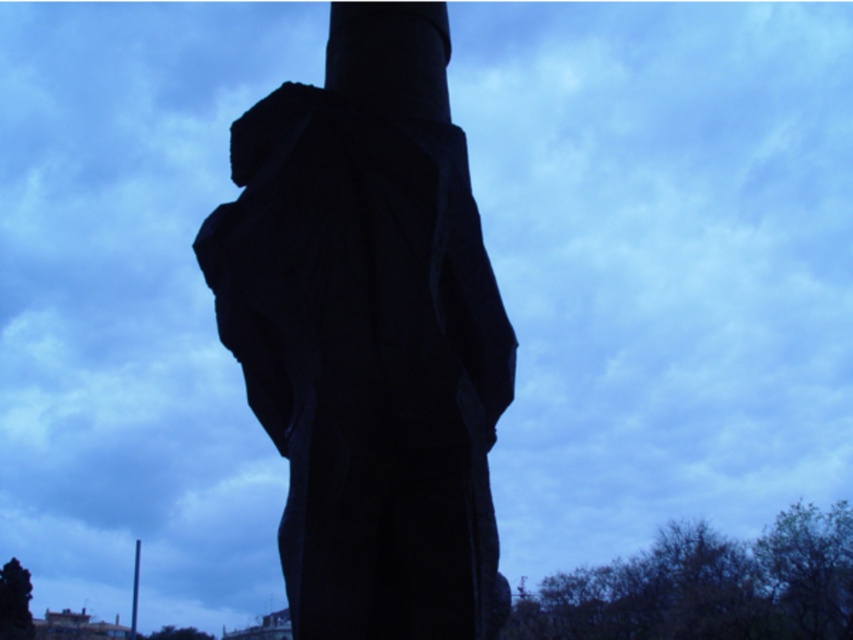
Does black stone statue at center have a greater height compared to dark green tree at lower left?

Yes.

Between black stone statue at center and dark green tree at lower left, which one is positioned lower?

dark green tree at lower left

At what (x,y) coordinates should I click in order to perform the action: click on black stone statue at center. Please return your answer as a coordinate pair (x, y). The height and width of the screenshot is (640, 853). Looking at the image, I should click on (369, 332).

The height and width of the screenshot is (640, 853). What are the coordinates of `black stone statue at center` in the screenshot? It's located at (369, 332).

Is point (496, 320) behind point (132, 605)?

No, (496, 320) is closer to viewer.

Is black stone statue at center smaller than smooth black pole at lower left?

Correct, black stone statue at center occupies less space than smooth black pole at lower left.

I want to click on black stone statue at center, so click(369, 332).

Find the location of `black stone statue at center`. black stone statue at center is located at coordinates (369, 332).

Does dark green tree at lower left have a smaller size compared to smooth black pole at lower left?

Yes, dark green tree at lower left is smaller than smooth black pole at lower left.

Which is more to the right, dark green tree at lower left or smooth black pole at lower left?

smooth black pole at lower left is more to the right.

Which is behind, point (25, 618) or point (134, 572)?

Point (134, 572)

What are the coordinates of `dark green tree at lower left` in the screenshot? It's located at (15, 602).